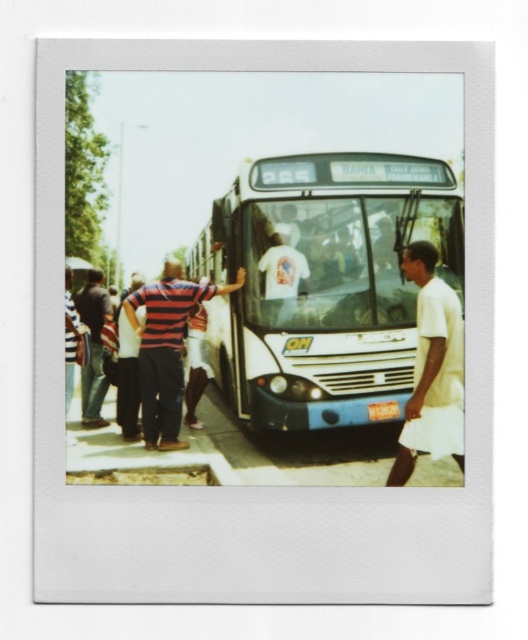
Does striped cotton shirt at center appear on the left side of denim pants at left?

In fact, striped cotton shirt at center is to the right of denim pants at left.

Consider the image. Does striped cotton shirt at center appear over denim pants at left?

Actually, striped cotton shirt at center is below denim pants at left.

Consider the image. Who is more distant from viewer, (152, 388) or (78, 298)?

Positioned behind is point (78, 298).

The width and height of the screenshot is (528, 640). In order to click on striped cotton shirt at center in this screenshot , I will do `click(166, 348)`.

Is white matte shirt at right wider than denim pants at left?

Correct, the width of white matte shirt at right exceeds that of denim pants at left.

Can you confirm if white matte shirt at right is smaller than denim pants at left?

Yes.

Which is behind, point (437, 449) or point (92, 340)?

Point (92, 340)

Where is `white matte shirt at right`? The height and width of the screenshot is (640, 528). white matte shirt at right is located at coordinates (431, 369).

Can you confirm if white matte shirt at right is bigger than striped shirt at left?

Yes.

Who is more forward, (409, 422) or (69, 346)?

Point (409, 422) is more forward.

Identify the location of white matte shirt at right. The image size is (528, 640). 431,369.

In order to click on white matte shirt at right in this screenshot , I will do `click(431, 369)`.